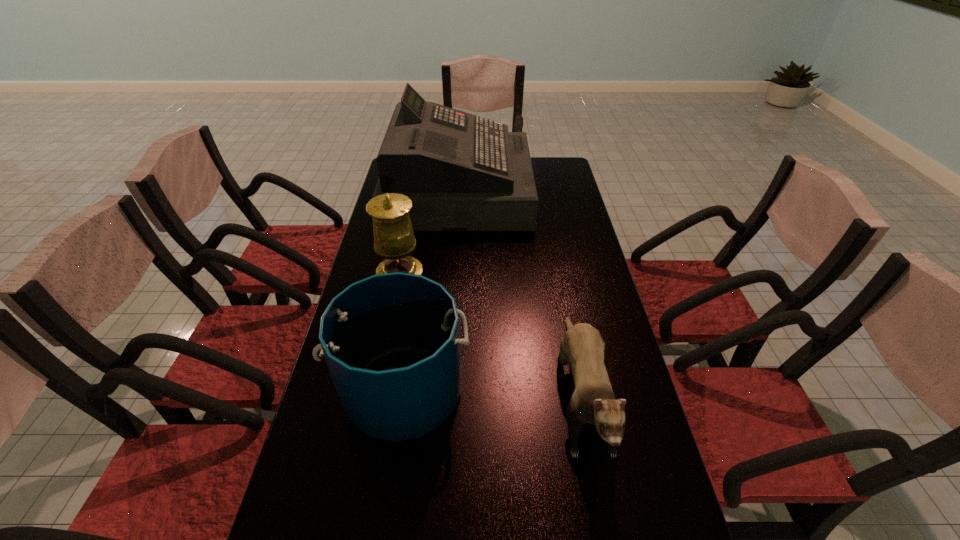
Where is `oil lamp at the left edge`? This screenshot has width=960, height=540. oil lamp at the left edge is located at coordinates (394, 240).

Locate an element on the screen. bucket that is at the left edge is located at coordinates (391, 341).

Where is `object located in the right edge section of the desktop`? The image size is (960, 540). object located in the right edge section of the desktop is located at coordinates (582, 346).

At what (x,y) coordinates should I click in order to perform the action: click on object located in the far left corner section of the desktop. Please return your answer as a coordinate pair (x, y). Looking at the image, I should click on (462, 172).

Image resolution: width=960 pixels, height=540 pixels. Identify the location of free space at the left edge of the desktop. (348, 433).

Identify the location of free region at the right edge of the desktop. (637, 535).

Where is `free space between the oil lamp and the farthest object`? This screenshot has width=960, height=540. free space between the oil lamp and the farthest object is located at coordinates (430, 239).

Find the location of a particular element. The width and height of the screenshot is (960, 540). empty space that is in between the oil lamp and the farthest object is located at coordinates (430, 239).

Find the location of a particular element. This screenshot has width=960, height=540. free space between the cash register and the third nearest object is located at coordinates (430, 239).

Point out which object is positioned as the third nearest to the farthest object. Please provide its 2D coordinates. Your answer should be formatted as a tuple, i.e. [(x, y)], where the tuple contains the x and y coordinates of a point satisfying the conditions above.

[(391, 341)]